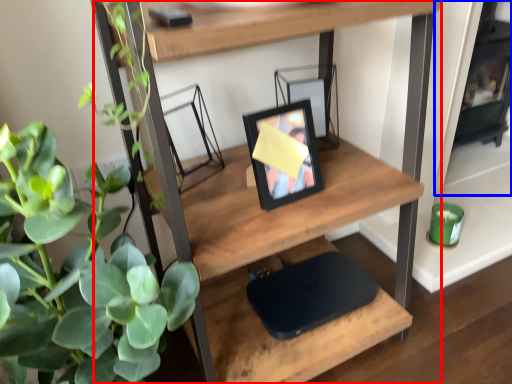
Question: Which object is closer to the camera taking this photo, shelf (highlighted by a red box) or fireplace (highlighted by a blue box)?

Choices:
 (A) shelf
 (B) fireplace

Answer: (A)